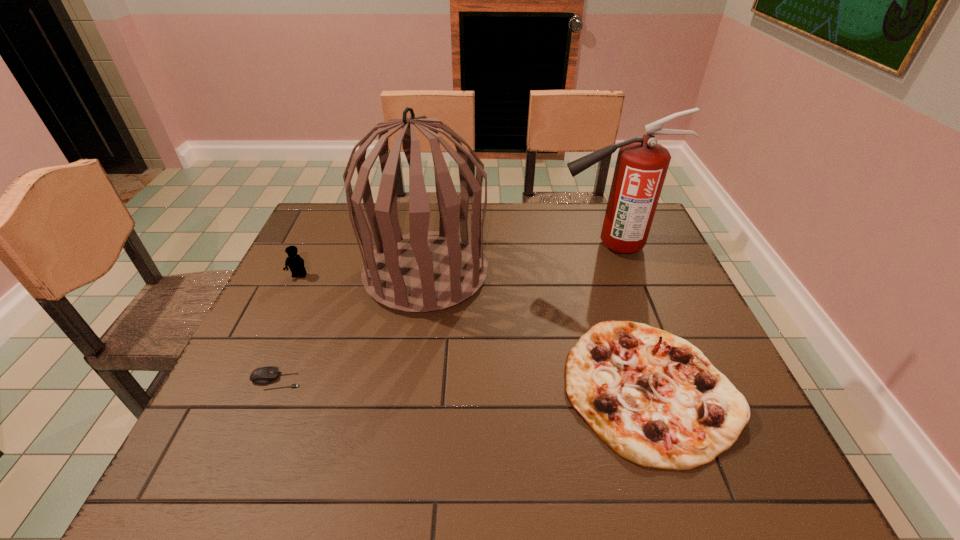
Identify the location of free space that is in between the fire extinguisher and the mouse. (443, 313).

Identify which object is the second nearest to the Lego. Please provide its 2D coordinates. Your answer should be formatted as a tuple, i.e. [(x, y)], where the tuple contains the x and y coordinates of a point satisfying the conditions above.

[(265, 375)]

Locate an element on the screen. Image resolution: width=960 pixels, height=540 pixels. object that is the fourth closest one to the Lego is located at coordinates (642, 164).

What are the coordinates of `vacant position in the image that satisfies the following two spatial constraints: 1. on the front side of the mouse; 2. on the left side of the pizza` in the screenshot? It's located at point(273,388).

Identify the location of free space that satisfies the following two spatial constraints: 1. at the nozzle of the fire extinguisher; 2. on the front-facing side of the third shortest object. This screenshot has height=540, width=960. (621, 276).